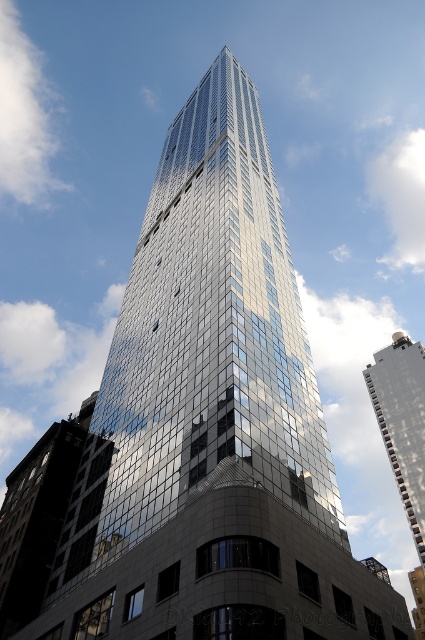
Question: Which point is closer to the camera taking this photo?

Choices:
 (A) (81, 410)
 (B) (407, 422)

Answer: (A)

Question: Does glossy glass building at center lie behind glossy glass building at upper center?

Choices:
 (A) no
 (B) yes

Answer: (A)

Question: Is glossy glass building at center thinner than glossy glass building at upper center?

Choices:
 (A) yes
 (B) no

Answer: (A)

Question: Can you confirm if glossy glass building at center is thinner than glossy glass building at upper center?

Choices:
 (A) no
 (B) yes

Answer: (B)